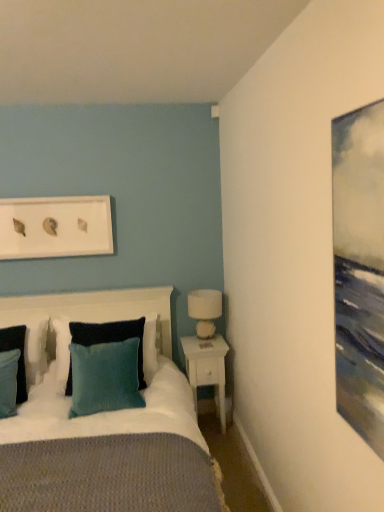
Question: From a real-world perspective, is white wood nightstand at lower right under white matte picture frame at upper center?

Choices:
 (A) no
 (B) yes

Answer: (B)

Question: Can you confirm if white wood nightstand at lower right is smaller than white matte picture frame at upper center?

Choices:
 (A) yes
 (B) no

Answer: (B)

Question: Is white wood nightstand at lower right wider than white matte picture frame at upper center?

Choices:
 (A) yes
 (B) no

Answer: (A)

Question: Is white wood nightstand at lower right completely or partially outside of white matte picture frame at upper center?

Choices:
 (A) no
 (B) yes

Answer: (B)

Question: Can you confirm if white wood nightstand at lower right is thinner than white matte picture frame at upper center?

Choices:
 (A) no
 (B) yes

Answer: (A)

Question: Looking at their shapes, would you say white wood nightstand at lower right is wider or thinner than velvet dark blue headboard at center?

Choices:
 (A) wide
 (B) thin

Answer: (B)

Question: From the image's perspective, relative to velvet dark blue headboard at center, is white wood nightstand at lower right above or below?

Choices:
 (A) below
 (B) above

Answer: (A)

Question: From a real-world perspective, relative to velvet dark blue headboard at center, is white wood nightstand at lower right vertically above or below?

Choices:
 (A) below
 (B) above

Answer: (A)

Question: Is white wood nightstand at lower right in front of or behind velvet dark blue headboard at center in the image?

Choices:
 (A) front
 (B) behind

Answer: (B)

Question: Considering the positions of teal fabric pillow at left, the second pillow positioned from the right, and teal fabric pillow at left, which is the third pillow from right to left, in the image, is teal fabric pillow at left, the second pillow positioned from the right, taller or shorter than teal fabric pillow at left, which is the third pillow from right to left,?

Choices:
 (A) tall
 (B) short

Answer: (A)

Question: Is teal fabric pillow at left, acting as the second pillow starting from the left, inside or outside of teal fabric pillow at left, which appears as the first pillow when viewed from the left?

Choices:
 (A) outside
 (B) inside

Answer: (A)

Question: Relative to teal fabric pillow at left, which is the third pillow from right to left, is teal fabric pillow at left, acting as the second pillow starting from the left, in front or behind?

Choices:
 (A) front
 (B) behind

Answer: (A)

Question: From a real-world perspective, relative to teal fabric pillow at left, which appears as the first pillow when viewed from the left, is teal fabric pillow at left, acting as the second pillow starting from the left, vertically above or below?

Choices:
 (A) below
 (B) above

Answer: (A)

Question: From the image's perspective, is white ceramic table lamp at right above or below teal fabric pillow at left, acting as the second pillow starting from the left?

Choices:
 (A) above
 (B) below

Answer: (A)

Question: From a real-world perspective, is white ceramic table lamp at right above or below teal fabric pillow at left, the second pillow positioned from the right?

Choices:
 (A) above
 (B) below

Answer: (A)